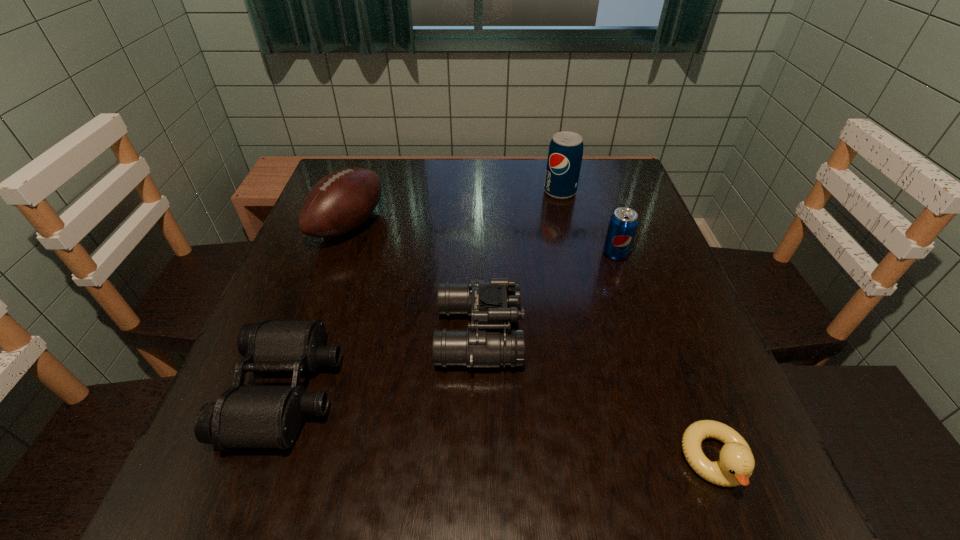
At what (x,y) coordinates should I click in order to perform the action: click on vacant space at the far right corner. Please return your answer as a coordinate pair (x, y). The image size is (960, 540). Looking at the image, I should click on (612, 198).

At what (x,y) coordinates should I click in order to perform the action: click on vacant space at the near right corner. Please return your answer as a coordinate pair (x, y). This screenshot has width=960, height=540. Looking at the image, I should click on (768, 494).

At what (x,y) coordinates should I click in order to perform the action: click on vacant area between the football (American) and the taller pop soda. Please return your answer as a coordinate pair (x, y). The width and height of the screenshot is (960, 540). Looking at the image, I should click on (454, 208).

I want to click on unoccupied position between the duckling and the football (American), so click(532, 342).

At what (x,y) coordinates should I click in order to perform the action: click on free space between the farther pop soda and the duckling. Please return your answer as a coordinate pair (x, y). The image size is (960, 540). Looking at the image, I should click on (637, 326).

The width and height of the screenshot is (960, 540). Identify the location of free space between the farther pop soda and the taller binoculars. (519, 263).

Identify the location of vacant area that lies between the fourth object from left to right and the duckling. (637, 326).

The image size is (960, 540). I want to click on vacant space that is in between the taller pop soda and the duckling, so click(x=637, y=326).

I want to click on empty space that is in between the football (American) and the duckling, so click(x=532, y=342).

Identify the location of vacant space in between the left binoculars and the duckling. (501, 425).